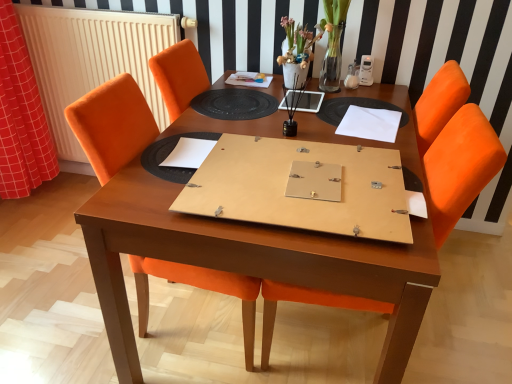
Question: Does point (344, 119) appear closer or farther from the camera than point (231, 104)?

Choices:
 (A) farther
 (B) closer

Answer: (B)

Question: Is white paper at upper right, positioned as the 2th notebook in bottom-to-top order, situated inside black rubber placemat at center or outside?

Choices:
 (A) inside
 (B) outside

Answer: (B)

Question: Estimate the real-world distances between objects in this image. Which object is closer to the white paper at upper right, the 1th notebook when ordered from right to left?

Choices:
 (A) white radiator at left
 (B) white paper at center, acting as the first notebook starting from the left
 (C) wooden table at center
 (D) red checkered fabric at left
 (E) matte white vase at upper center

Answer: (C)

Question: Which of these objects is positioned farthest from the matte white vase at upper center?

Choices:
 (A) white paper at upper right, the 2th notebook when ordered from left to right
 (B) white radiator at left
 (C) orange fabric chair at center, which appears as the 2th chair when viewed from the left
 (D) black rubber placemat at center
 (E) orange fabric chair at center, the 2th chair when ordered from right to left

Answer: (E)